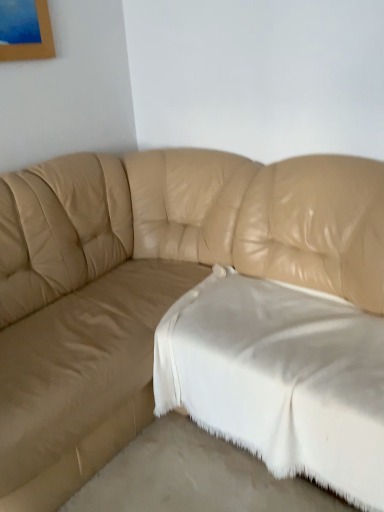
Identify the location of tan leather couch at center. The width and height of the screenshot is (384, 512). (148, 283).

The width and height of the screenshot is (384, 512). I want to click on white soft fabric at lower right, so click(x=280, y=378).

Describe the element at coordinates (280, 378) in the screenshot. I see `white soft fabric at lower right` at that location.

Find the location of a particular element. The image size is (384, 512). white fabric at lower center is located at coordinates (194, 477).

Where is `tan leather couch at center`? tan leather couch at center is located at coordinates click(148, 283).

From the image's perspective, is white soft fabric at lower right on top of white fabric at lower center?

Yes, from the image's perspective, white soft fabric at lower right is above white fabric at lower center.

Considering the sizes of white soft fabric at lower right and white fabric at lower center in the image, is white soft fabric at lower right taller or shorter than white fabric at lower center?

Clearly, white soft fabric at lower right is taller compared to white fabric at lower center.

How different are the orientations of white soft fabric at lower right and white fabric at lower center in degrees?

1.9 degrees.

Is white soft fabric at lower right with white fabric at lower center?

No, white soft fabric at lower right is not touching white fabric at lower center.

Considering the positions of points (99, 249) and (277, 309), is point (99, 249) closer to camera compared to point (277, 309)?

That is False.

Considering the sizes of objects tan leather couch at center and white soft fabric at lower right in the image provided, who is wider, tan leather couch at center or white soft fabric at lower right?

tan leather couch at center is wider.

At what (x,y) coordinates should I click in order to perform the action: click on studio couch on the left of white soft fabric at lower right. Please return your answer as a coordinate pair (x, y). This screenshot has height=512, width=384. Looking at the image, I should click on pos(148,283).

Is tan leather couch at center not close to white soft fabric at lower right?

No, tan leather couch at center is in close proximity to white soft fabric at lower right.

Who is smaller, white fabric at lower center or tan leather couch at center?

white fabric at lower center.

Is white fabric at lower center beside tan leather couch at center?

They are not placed beside each other.

Could you tell me if white fabric at lower center is turned towards tan leather couch at center?

Yes.

Where is `studio couch above the white fabric at lower center (from a real-world perspective)`? studio couch above the white fabric at lower center (from a real-world perspective) is located at coordinates (148, 283).

Which of these two, white soft fabric at lower right or tan leather couch at center, is thinner?

Thinner between the two is white soft fabric at lower right.

Which point is more forward, (329, 356) or (66, 243)?

The point (329, 356) is closer to the camera.

In the image, there is a tan leather couch at center. Where is `sheet below it (from a real-world perspective)`? This screenshot has height=512, width=384. sheet below it (from a real-world perspective) is located at coordinates (280, 378).

Are white soft fabric at lower right and tan leather couch at center located far from each other?

white soft fabric at lower right is near tan leather couch at center, not far away.

Is tan leather couch at center not close to white fabric at lower center?

No, tan leather couch at center is not far from white fabric at lower center.

Between point (23, 179) and point (275, 500), which one is positioned behind?

Point (23, 179)

Is tan leather couch at center wider than white fabric at lower center?

Yes.

Considering the relative positions of white fabric at lower center and white soft fabric at lower right in the image provided, is white fabric at lower center to the left of white soft fabric at lower right from the viewer's perspective?

Correct, you'll find white fabric at lower center to the left of white soft fabric at lower right.

From a real-world perspective, which object stands above the other?

white soft fabric at lower right is physically above.

In the image, is white fabric at lower center positioned in front of or behind white soft fabric at lower right?

white fabric at lower center is in front of white soft fabric at lower right.

Locate an element on the screen. concrete located in front of the white soft fabric at lower right is located at coordinates (194, 477).

At what (x,y) coordinates should I click in order to perform the action: click on studio couch on the left side of white soft fabric at lower right. Please return your answer as a coordinate pair (x, y). This screenshot has width=384, height=512. Looking at the image, I should click on (148, 283).

From the image, which object appears to be farther from tan leather couch at center, white fabric at lower center or white soft fabric at lower right?

The object further to tan leather couch at center is white fabric at lower center.

From the picture: Considering their positions, is tan leather couch at center positioned further to white fabric at lower center than white soft fabric at lower right?

tan leather couch at center is positioned further to the anchor white fabric at lower center.

From the image, which object appears to be nearer to white soft fabric at lower right, white fabric at lower center or tan leather couch at center?

The object closer to white soft fabric at lower right is white fabric at lower center.

From the image, which object appears to be nearer to white fabric at lower center, white soft fabric at lower right or tan leather couch at center?

white soft fabric at lower right is closer to white fabric at lower center.

Estimate the real-world distances between objects in this image. Which object is closer to white soft fabric at lower right, tan leather couch at center or white fabric at lower center?

The object closer to white soft fabric at lower right is white fabric at lower center.

Based on the photo, estimate the real-world distances between objects in this image. Which object is closer to tan leather couch at center, white soft fabric at lower right or white fabric at lower center?

Based on the image, white soft fabric at lower right appears to be nearer to tan leather couch at center.

Where is `concrete between tan leather couch at center and white soft fabric at lower right along the z-axis`? Image resolution: width=384 pixels, height=512 pixels. concrete between tan leather couch at center and white soft fabric at lower right along the z-axis is located at coordinates (194, 477).